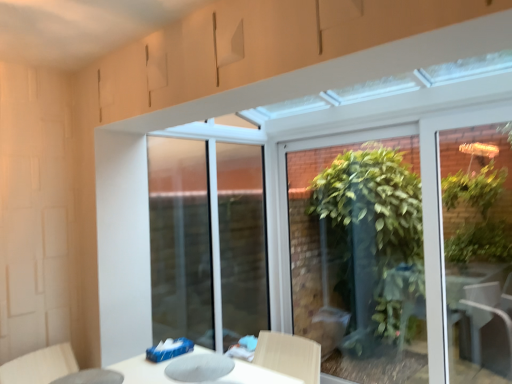
What do you see at coordinates (91, 377) in the screenshot?
I see `transparent glass table at lower left` at bounding box center [91, 377].

Locate an element on the screen. The width and height of the screenshot is (512, 384). transparent glass table at lower left is located at coordinates (91, 377).

What is the approximate width of light beige fabric swivel chair at lower left?

20.23 inches.

Where is `transparent glass table at lower left`? This screenshot has height=384, width=512. transparent glass table at lower left is located at coordinates (91, 377).

Is green leafy plant at center not inside transparent glass table at lower left?

Absolutely, green leafy plant at center is external to transparent glass table at lower left.

Are green leafy plant at center and transparent glass table at lower left making contact?

No, green leafy plant at center is not with transparent glass table at lower left.

Is green leafy plant at center looking in the opposite direction of transparent glass table at lower left?

green leafy plant at center is not turned away from transparent glass table at lower left.

Looking at this image, is transparent glass table at lower left oriented away from light beige fabric swivel chair at lower left?

transparent glass table at lower left does not have its back to light beige fabric swivel chair at lower left.

Looking at this image, considering the relative sizes of transparent glass table at lower left and light beige fabric swivel chair at lower left in the image provided, is transparent glass table at lower left bigger than light beige fabric swivel chair at lower left?

Actually, transparent glass table at lower left might be smaller than light beige fabric swivel chair at lower left.

Between transparent glass table at lower left and light beige fabric swivel chair at lower left, which one appears on the right side from the viewer's perspective?

transparent glass table at lower left is more to the right.

Considering the relative positions of transparent glass table at lower left and light beige fabric swivel chair at lower left in the image provided, is transparent glass table at lower left in front of light beige fabric swivel chair at lower left?

Yes.

Is green leafy plant at center located within light beige fabric swivel chair at lower left?

No, green leafy plant at center is not surrounded by light beige fabric swivel chair at lower left.

Based on the photo, can you tell me how much light beige fabric swivel chair at lower left and green leafy plant at center differ in facing direction?

They differ by 103 degrees in their facing directions.

Between light beige fabric swivel chair at lower left and green leafy plant at center, which one appears on the left side from the viewer's perspective?

light beige fabric swivel chair at lower left is more to the left.

Is green leafy plant at center at the back of light beige fabric swivel chair at lower left?

light beige fabric swivel chair at lower left does not have its back to green leafy plant at center.

Consider the image. Is green leafy plant at center far away from light beige fabric swivel chair at lower left?

Indeed, green leafy plant at center is not near light beige fabric swivel chair at lower left.

Looking at this image, from the image's perspective, is green leafy plant at center above or below light beige fabric swivel chair at lower left?

Based on their image positions, green leafy plant at center is located above light beige fabric swivel chair at lower left.

From a real-world perspective, is green leafy plant at center physically below light beige fabric swivel chair at lower left?

No.

Image resolution: width=512 pixels, height=384 pixels. I want to click on swivel chair to the left of green leafy plant at center, so click(40, 365).

Between light beige fabric swivel chair at lower left and transparent glass table at lower left, which one has larger width?

Wider between the two is light beige fabric swivel chair at lower left.

Considering the relative sizes of light beige fabric swivel chair at lower left and transparent glass table at lower left in the image provided, is light beige fabric swivel chair at lower left smaller than transparent glass table at lower left?

No, light beige fabric swivel chair at lower left is not smaller than transparent glass table at lower left.

How different are the orientations of light beige fabric swivel chair at lower left and transparent glass table at lower left in degrees?

light beige fabric swivel chair at lower left and transparent glass table at lower left are facing 165 degrees away from each other.

Consider the image. Would you say light beige fabric swivel chair at lower left contains transparent glass table at lower left?

Absolutely, transparent glass table at lower left is inside light beige fabric swivel chair at lower left.

Can you confirm if transparent glass table at lower left is shorter than green leafy plant at center?

Indeed, transparent glass table at lower left has a lesser height compared to green leafy plant at center.

This screenshot has width=512, height=384. Identify the location of glass table below the green leafy plant at center (from a real-world perspective). (91, 377).

Is point (114, 373) positioned in front of point (370, 346)?

Yes, it is.

Find the location of a particular element. The image size is (512, 384). glass table beneath the green leafy plant at center (from a real-world perspective) is located at coordinates (91, 377).

Find the location of a particular element. This screenshot has width=512, height=384. swivel chair on the left of transparent glass table at lower left is located at coordinates (40, 365).

Considering their positions, is transparent glass table at lower left positioned closer to light beige fabric swivel chair at lower left than green leafy plant at center?

transparent glass table at lower left.

Considering their positions, is transparent glass table at lower left positioned further to green leafy plant at center than light beige fabric swivel chair at lower left?

Based on the image, transparent glass table at lower left appears to be further to green leafy plant at center.

Consider the image. Considering their positions, is green leafy plant at center positioned further to transparent glass table at lower left than light beige fabric swivel chair at lower left?

The object further to transparent glass table at lower left is green leafy plant at center.

Which object lies nearer to the anchor point transparent glass table at lower left, light beige fabric swivel chair at lower left or green leafy plant at center?

light beige fabric swivel chair at lower left is closer to transparent glass table at lower left.

When comparing their distances from green leafy plant at center, does light beige fabric swivel chair at lower left or transparent glass table at lower left seem closer?

light beige fabric swivel chair at lower left lies closer to green leafy plant at center than the other object.

Based on their spatial positions, is green leafy plant at center or transparent glass table at lower left closer to light beige fabric swivel chair at lower left?

transparent glass table at lower left.

You are a GUI agent. You are given a task and a screenshot of the screen. Output one action in this format:
    pyautogui.click(x=<x>, y=<y>)
    Task: Click on the glass table between light beige fabric swivel chair at lower left and green leafy plant at center
    The height and width of the screenshot is (384, 512).
    Given the screenshot: What is the action you would take?
    pyautogui.click(x=91, y=377)